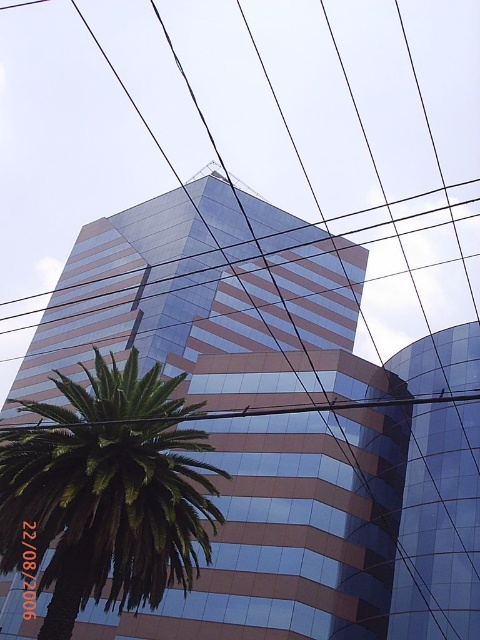
Question: Does glassy reflective building at center have a smaller size compared to green leafy palm at lower left?

Choices:
 (A) yes
 (B) no

Answer: (B)

Question: Is glassy reflective building at center bigger than green leafy palm at lower left?

Choices:
 (A) no
 (B) yes

Answer: (B)

Question: Is glassy reflective building at center positioned at the back of green leafy palm at lower left?

Choices:
 (A) no
 (B) yes

Answer: (A)

Question: Which object is farther from the camera taking this photo?

Choices:
 (A) glassy reflective building at center
 (B) green leafy palm at lower left

Answer: (B)

Question: Which point appears farthest from the camera in this image?

Choices:
 (A) (335, 364)
 (B) (187, 577)

Answer: (A)